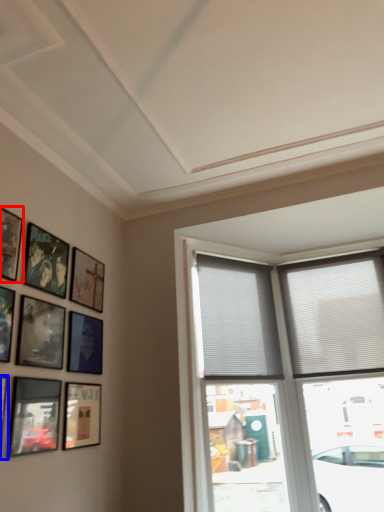
Question: Which point is closer to the camera, picture frame (highlighted by a red box) or picture frame (highlighted by a blue box)?

Choices:
 (A) picture frame
 (B) picture frame

Answer: (B)